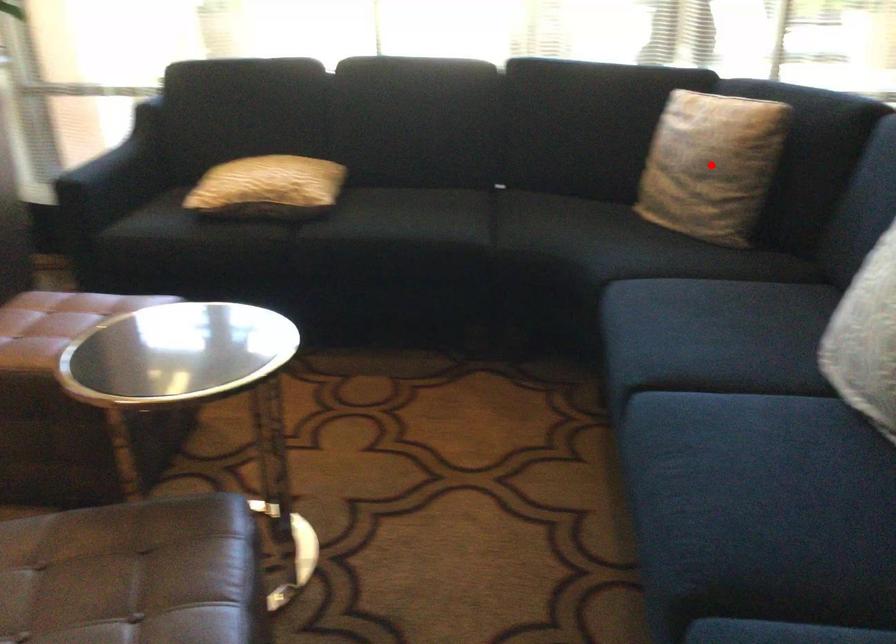
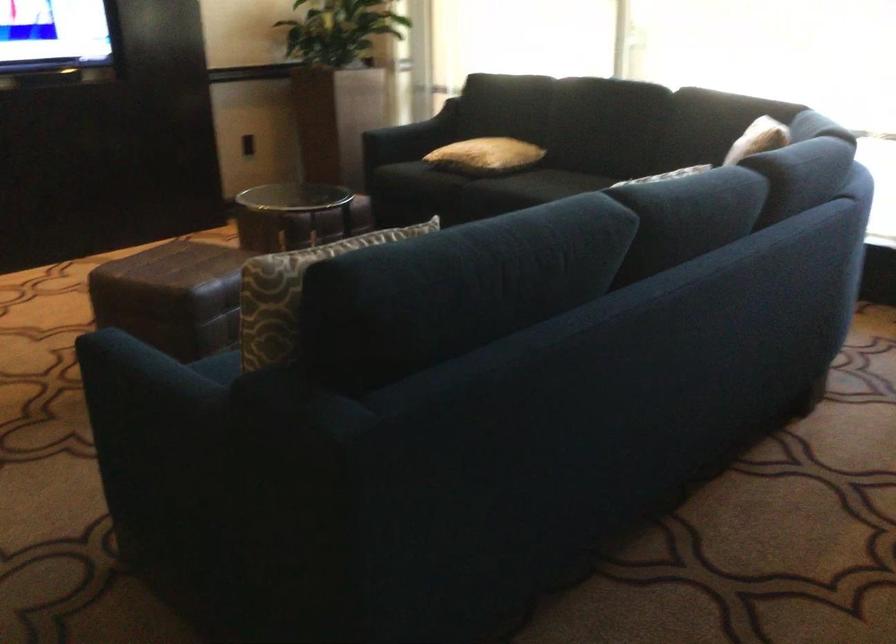
Question: I am providing you with two images of the same scene from different viewpoints. A red point is marked on the first image. At the location where the point appears in image 1, is it still visible in image 2?

Choices:
 (A) Yes
 (B) No

Answer: (B)